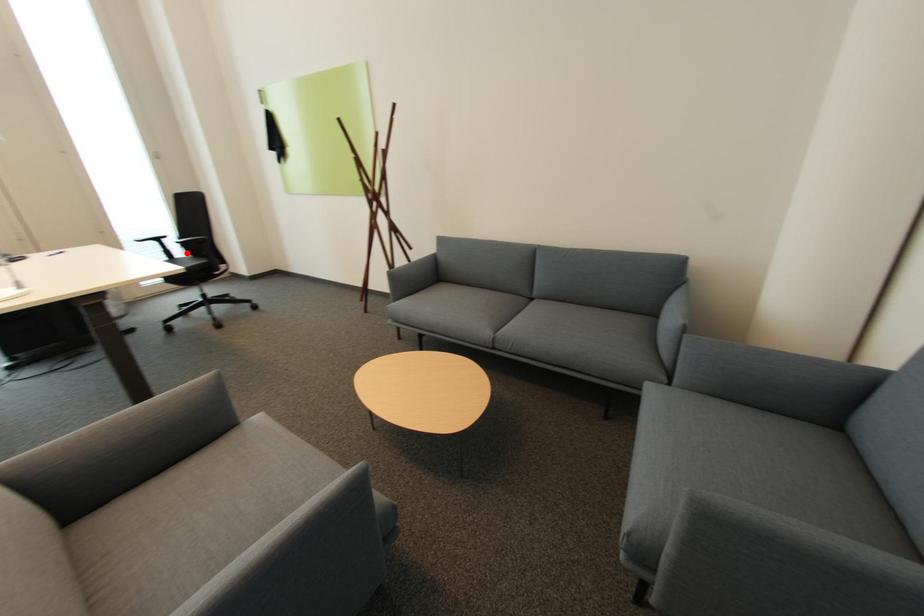
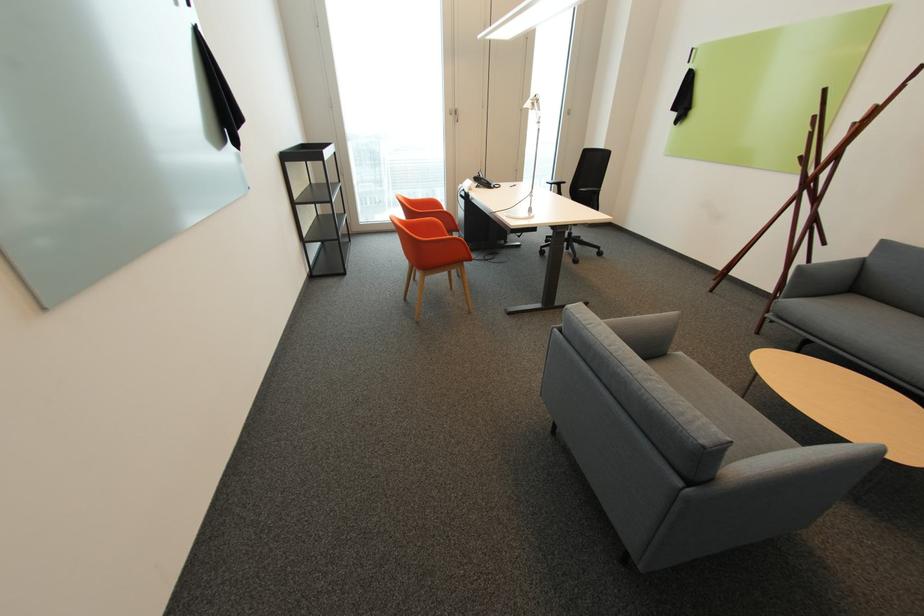
Question: I am providing you with two images of the same scene from different viewpoints. A red point is marked on the first image. Can you still see the location of the red point in image 2?

Choices:
 (A) Yes
 (B) No

Answer: (B)